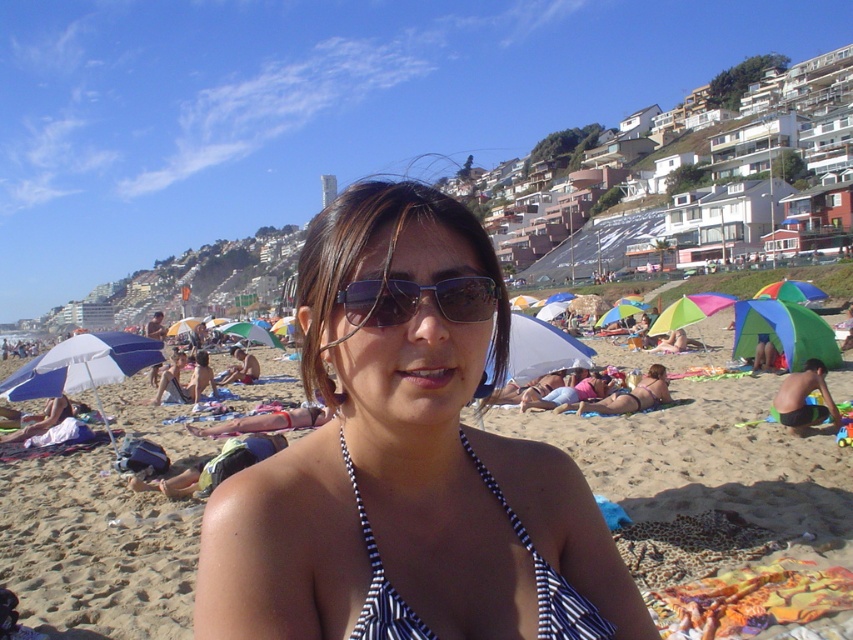
Who is taller, white striped bikini top at center or matte bikini top at center?

white striped bikini top at center

Is white striped bikini top at center closer to the viewer compared to matte bikini top at center?

Yes, it is.

Who is more distant from viewer, (67, 500) or (645, 390)?

Point (645, 390)

This screenshot has width=853, height=640. Identify the location of white striped bikini top at center. (708, 461).

Which is above, black striped bikini top at center or white striped bikini top at center?

black striped bikini top at center

Where is `black striped bikini top at center`? This screenshot has height=640, width=853. black striped bikini top at center is located at coordinates (407, 461).

Where is `black striped bikini top at center`? black striped bikini top at center is located at coordinates (407, 461).

Identify the location of black striped bikini top at center. (407, 461).

Find the location of a particular element. Image resolution: width=853 pixels, height=640 pixels. black striped bikini top at center is located at coordinates (407, 461).